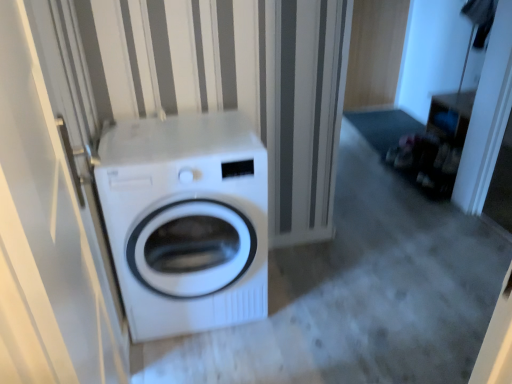
The image size is (512, 384). Identify the location of vacant space to the right of white glossy washing machine at center. (309, 301).